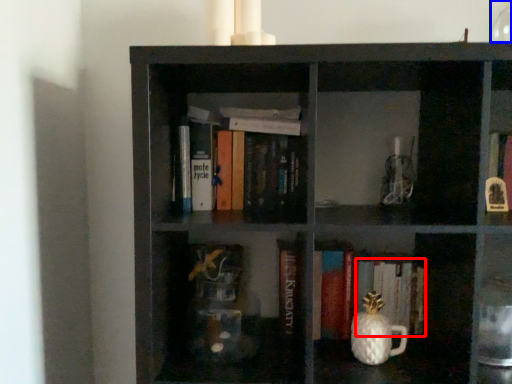
Question: Which of the following is the closest to the observer, book (highlighted by a red box) or glass vase (highlighted by a blue box)?

Choices:
 (A) book
 (B) glass vase

Answer: (B)